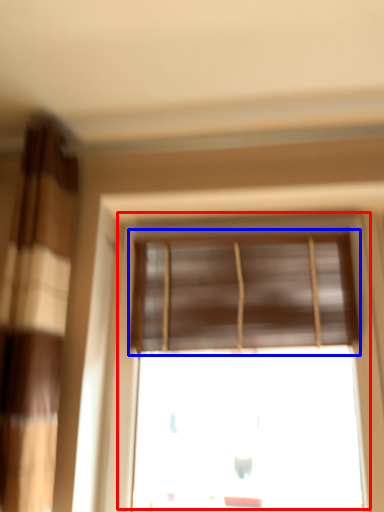
Question: Which object appears farthest to the camera in this image, window (highlighted by a red box) or window blind (highlighted by a blue box)?

Choices:
 (A) window
 (B) window blind

Answer: (B)